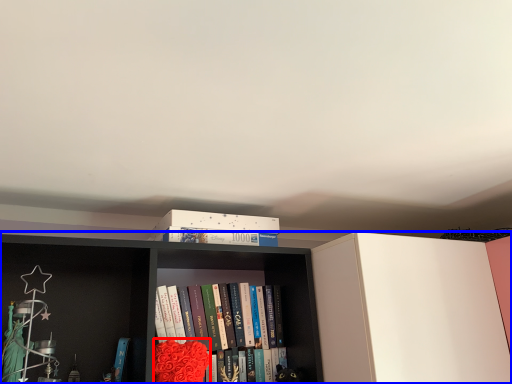
Question: Among these objects, which one is nearest to the camera, flower (highlighted by a red box) or bookcase (highlighted by a blue box)?

Choices:
 (A) flower
 (B) bookcase

Answer: (B)